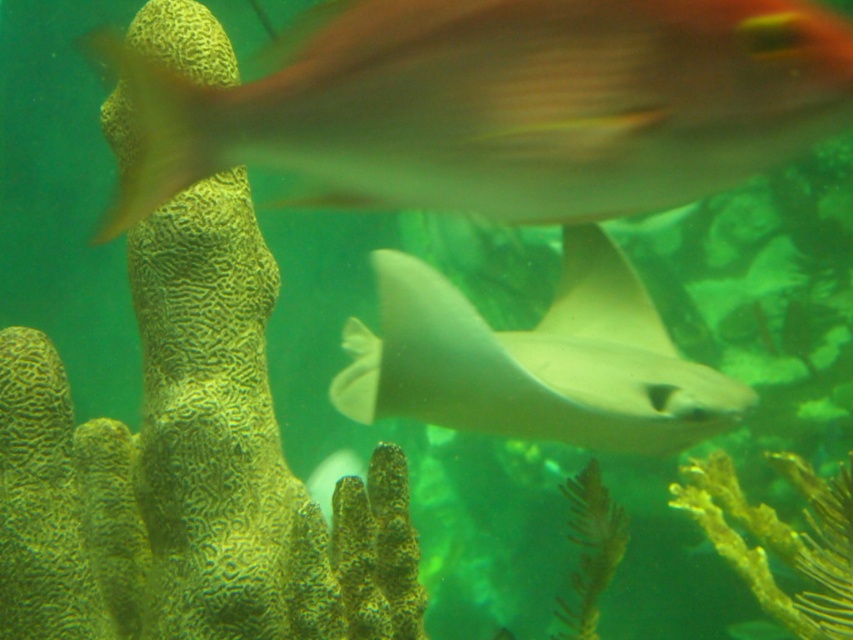
You are an underwater photographer holding a camera that requires you to be within 30 inches of your subject to take a clear photo. You want to capture an image of the point at coordinates point (700,188). Based on the scene described, can you take a clear photo of this point with your current equipment?

The distance of point (700,188) from viewer is 33.30 inches, which is beyond the 30 inches required for a clear photo. Therefore, you cannot take a clear photo of point (700,188) with your current equipment.

You are a marine biologist observing this underwater scene. You notice a translucent white fish at upper center. If you want to take a close look at it using a 30 inch long snorkel, will the snorkel be long enough to reach the fish?

The distance between the translucent white fish at upper center and the viewer is 29.56 inches. Since the snorkel is 30 inches long, it is slightly longer than the distance required. Therefore, the snorkel will be long enough to reach the fish.

You are an underwater photographer aiming to capture both the translucent white fish at upper center and the smooth gray stingray at center in a single shot. Given their sizes, which one might require you to adjust your camera focus more due to its size?

The translucent white fish at upper center is thinner than the smooth gray stingray at center, so the stingray may require more focus adjustment because it is wider.